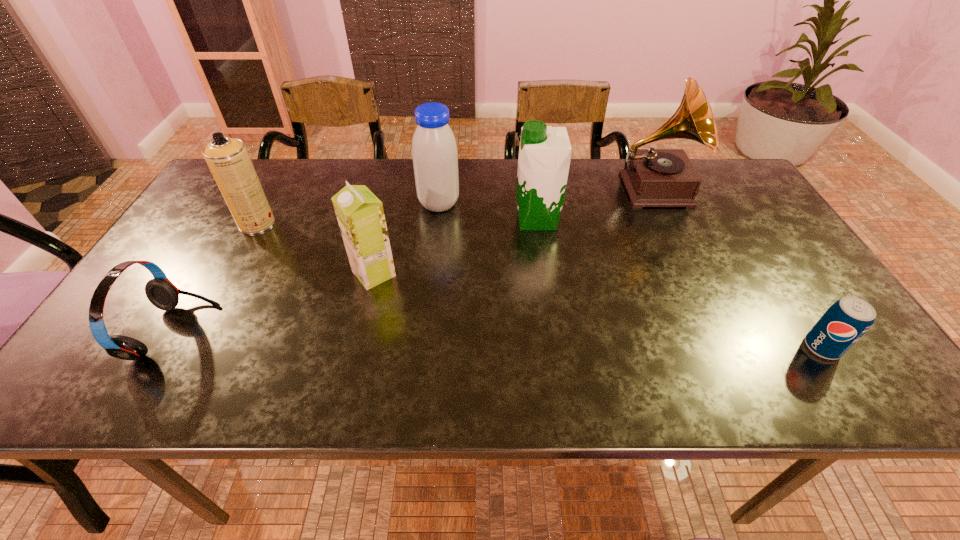
Where is `soya milk that is at the far edge`? This screenshot has width=960, height=540. soya milk that is at the far edge is located at coordinates (434, 150).

This screenshot has height=540, width=960. I want to click on headset positioned at the near edge, so coord(161,292).

Where is `pop located in the near edge section of the desktop`? This screenshot has width=960, height=540. pop located in the near edge section of the desktop is located at coordinates (848, 319).

In order to click on aerosol can located in the left edge section of the desktop in this screenshot , I will do `click(227, 158)`.

Where is `headset that is at the left edge`? This screenshot has width=960, height=540. headset that is at the left edge is located at coordinates (161, 292).

Locate an element on the screen. This screenshot has height=540, width=960. object present at the right edge is located at coordinates (848, 319).

I want to click on object that is at the near left corner, so click(161, 292).

What are the coordinates of `object present at the near right corner` in the screenshot? It's located at (848, 319).

At what (x,y) coordinates should I click in order to perform the action: click on vacant space at the far edge of the desktop. Please return your answer as a coordinate pair (x, y). Looking at the image, I should click on (588, 180).

You are a GUI agent. You are given a task and a screenshot of the screen. Output one action in this format:
    pyautogui.click(x=<x>, y=<y>)
    Task: Click on the free space at the near edge of the desktop
    The width and height of the screenshot is (960, 540).
    Given the screenshot: What is the action you would take?
    pos(251,392)